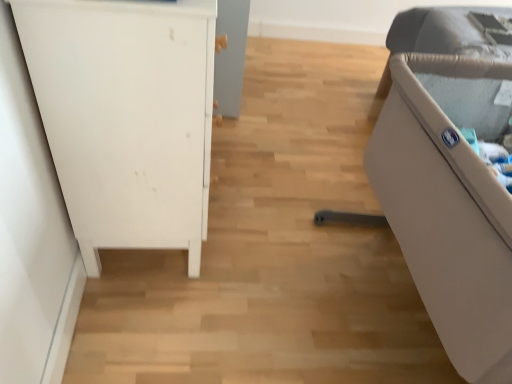
Describe the element at coordinates (449, 203) in the screenshot. I see `beige plastic crib at right, the 1th furniture when ordered from right to left` at that location.

What is the approximate width of beige plastic crib at right, the 1th furniture when ordered from right to left?

36.99 inches.

Consider the image. In order to face beige plastic crib at right, the 1th furniture when ordered from right to left, should I rotate leftwards or rightwards?

Turn right approximately 26.644 degrees to face it.

Identify the location of beige plastic crib at right, the 1th furniture when ordered from right to left. (449, 203).

Measure the distance between point (177,33) and camera.

A distance of 34.13 inches exists between point (177,33) and camera.

What do you see at coordinates (126, 117) in the screenshot? This screenshot has height=384, width=512. I see `white matte cabinet at left, which is the second furniture in right-to-left order` at bounding box center [126, 117].

Measure the distance between white matte cabinet at left, which is the second furniture in right-to-left order, and camera.

80.98 centimeters.

The width and height of the screenshot is (512, 384). What are the coordinates of `white matte cabinet at left, which is the second furniture in right-to-left order` in the screenshot? It's located at (126, 117).

Where is `beige plastic crib at right, the 1th furniture when ordered from right to left`? The width and height of the screenshot is (512, 384). beige plastic crib at right, the 1th furniture when ordered from right to left is located at coordinates (449, 203).

Between beige plastic crib at right, the 1th furniture when ordered from right to left, and white matte cabinet at left, which is the second furniture in right-to-left order, which one appears on the right side from the viewer's perspective?

From the viewer's perspective, beige plastic crib at right, the 1th furniture when ordered from right to left, appears more on the right side.

Relative to white matte cabinet at left, positioned as the 1th furniture in left-to-right order, is beige plastic crib at right, the second furniture from the left, in front or behind?

In the image, beige plastic crib at right, the second furniture from the left, appears in front of white matte cabinet at left, positioned as the 1th furniture in left-to-right order.

Looking at this image, which point is more forward, (x=420, y=75) or (x=36, y=93)?

The point (x=36, y=93) is closer.

From the image's perspective, is beige plastic crib at right, the 1th furniture when ordered from right to left, beneath white matte cabinet at left, which is the second furniture in right-to-left order?

Yes, from the image's perspective, beige plastic crib at right, the 1th furniture when ordered from right to left, is beneath white matte cabinet at left, which is the second furniture in right-to-left order.

Based on the photo, from a real-world perspective, does beige plastic crib at right, the 1th furniture when ordered from right to left, stand above white matte cabinet at left, positioned as the 1th furniture in left-to-right order?

Actually, beige plastic crib at right, the 1th furniture when ordered from right to left, is physically below white matte cabinet at left, positioned as the 1th furniture in left-to-right order, in the real world.

Which object is thinner, beige plastic crib at right, the 1th furniture when ordered from right to left, or white matte cabinet at left, which is the second furniture in right-to-left order?

Thinner between the two is white matte cabinet at left, which is the second furniture in right-to-left order.

Does beige plastic crib at right, the second furniture from the left, have a lesser height compared to white matte cabinet at left, positioned as the 1th furniture in left-to-right order?

Yes, beige plastic crib at right, the second furniture from the left, is shorter than white matte cabinet at left, positioned as the 1th furniture in left-to-right order.

Can you confirm if beige plastic crib at right, the second furniture from the left, is smaller than white matte cabinet at left, which is the second furniture in right-to-left order?

Incorrect, beige plastic crib at right, the second furniture from the left, is not smaller in size than white matte cabinet at left, which is the second furniture in right-to-left order.

Is beige plastic crib at right, the second furniture from the left, surrounding white matte cabinet at left, which is the second furniture in right-to-left order?

No, white matte cabinet at left, which is the second furniture in right-to-left order, is not inside beige plastic crib at right, the second furniture from the left.

Are beige plastic crib at right, the second furniture from the left, and white matte cabinet at left, positioned as the 1th furniture in left-to-right order, far apart?

No.

Is beige plastic crib at right, the second furniture from the left, facing towards white matte cabinet at left, which is the second furniture in right-to-left order?

No, beige plastic crib at right, the second furniture from the left, is not aimed at white matte cabinet at left, which is the second furniture in right-to-left order.

The height and width of the screenshot is (384, 512). I want to click on furniture lying on the left of beige plastic crib at right, the 1th furniture when ordered from right to left, so click(x=126, y=117).

Which is more to the right, white matte cabinet at left, which is the second furniture in right-to-left order, or beige plastic crib at right, the 1th furniture when ordered from right to left?

From the viewer's perspective, beige plastic crib at right, the 1th furniture when ordered from right to left, appears more on the right side.

Which object is further away from the camera, white matte cabinet at left, positioned as the 1th furniture in left-to-right order, or beige plastic crib at right, the second furniture from the left?

white matte cabinet at left, positioned as the 1th furniture in left-to-right order, is behind.

Is point (96, 12) closer or farther from the camera than point (415, 88)?

Point (96, 12) is closer to the camera than point (415, 88).

From the image's perspective, which one is positioned higher, white matte cabinet at left, positioned as the 1th furniture in left-to-right order, or beige plastic crib at right, the 1th furniture when ordered from right to left?

white matte cabinet at left, positioned as the 1th furniture in left-to-right order, from the image's perspective.

From a real-world perspective, is white matte cabinet at left, which is the second furniture in right-to-left order, physically located above or below beige plastic crib at right, the second furniture from the left?

white matte cabinet at left, which is the second furniture in right-to-left order, is above beige plastic crib at right, the second furniture from the left.

Looking at their sizes, would you say white matte cabinet at left, which is the second furniture in right-to-left order, is wider or thinner than beige plastic crib at right, the second furniture from the left?

white matte cabinet at left, which is the second furniture in right-to-left order, is thinner than beige plastic crib at right, the second furniture from the left.

From the picture: Is white matte cabinet at left, which is the second furniture in right-to-left order, taller than beige plastic crib at right, the 1th furniture when ordered from right to left?

Yes, white matte cabinet at left, which is the second furniture in right-to-left order, is taller than beige plastic crib at right, the 1th furniture when ordered from right to left.

Which of these two, white matte cabinet at left, which is the second furniture in right-to-left order, or beige plastic crib at right, the second furniture from the left, is smaller?

With smaller size is white matte cabinet at left, which is the second furniture in right-to-left order.

Could beige plastic crib at right, the 1th furniture when ordered from right to left, be considered to be inside white matte cabinet at left, positioned as the 1th furniture in left-to-right order?

No, beige plastic crib at right, the 1th furniture when ordered from right to left, is not surrounded by white matte cabinet at left, positioned as the 1th furniture in left-to-right order.

Is white matte cabinet at left, positioned as the 1th furniture in left-to-right order, positioned with its back to beige plastic crib at right, the second furniture from the left?

white matte cabinet at left, positioned as the 1th furniture in left-to-right order, does not have its back to beige plastic crib at right, the second furniture from the left.

There is a beige plastic crib at right, the second furniture from the left. Identify the location of furniture above it (from a real-world perspective). (126, 117).

Find the location of a particular element. The width and height of the screenshot is (512, 384). furniture that appears above the beige plastic crib at right, the 1th furniture when ordered from right to left (from the image's perspective) is located at coordinates (126, 117).

Find the location of `furniture above the beige plastic crib at right, the 1th furniture when ordered from right to left (from a real-world perspective)`. furniture above the beige plastic crib at right, the 1th furniture when ordered from right to left (from a real-world perspective) is located at coordinates (126, 117).